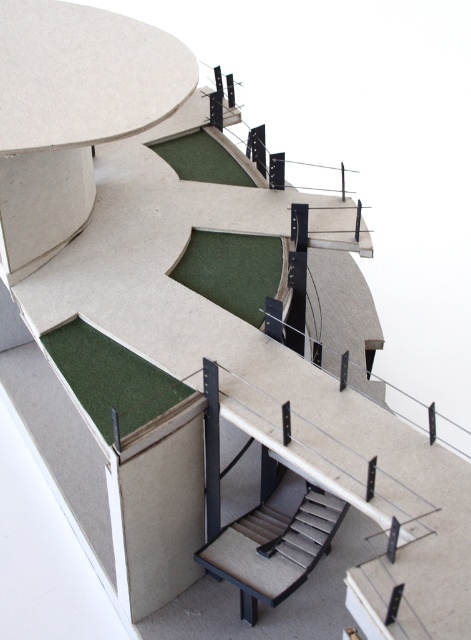
You are standing at the entrance of the model structure and see the point at coordinates (274,545). Based on the description, where exactly is this point located?

The point at coordinates (274,545) is located on the gray fabric stairs at center.

You are an architect examining the model of the structure. You need to determine the relative positions of the green felt carpet at lower left and the green felt carpet at upper center. Which one is nearer to you?

The green felt carpet at lower left is closer to the viewer than the green felt carpet at upper center.

You are standing at the entrance of the model structure and need to reach the observation deck located at the far end. The gray fabric stairs at center are part of your path. Based on their position, can you determine if the stairs are positioned to your left, right, or directly ahead?

The gray fabric stairs at center are located at point coordinates that place them directly ahead in your path towards the observation deck.